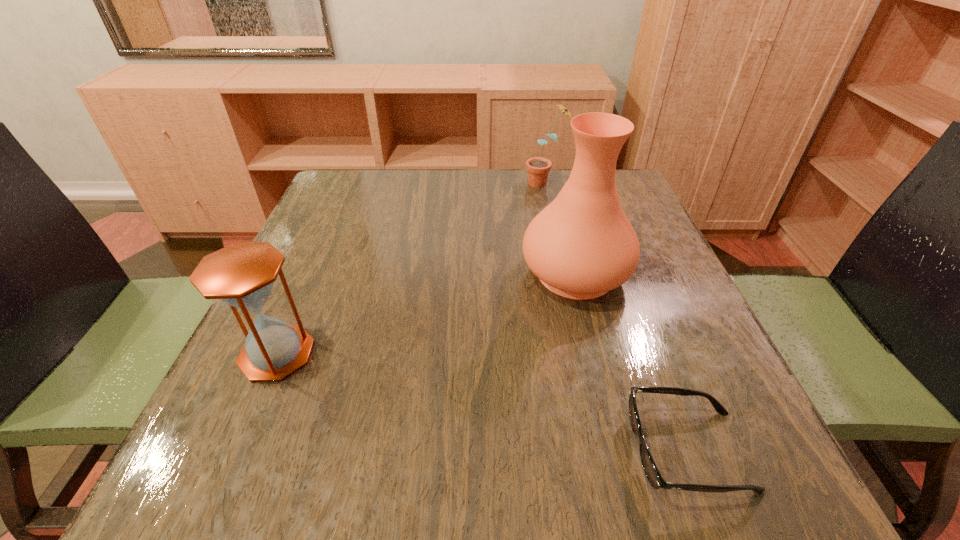
Find the location of `vacant space that's between the farthest object and the nearest object`. vacant space that's between the farthest object and the nearest object is located at coordinates (616, 317).

The height and width of the screenshot is (540, 960). I want to click on free space between the spectacles and the hourglass, so click(x=482, y=402).

At what (x,y) coordinates should I click in order to perform the action: click on free spot between the leftmost object and the farthest object. Please return your answer as a coordinate pair (x, y). Image resolution: width=960 pixels, height=540 pixels. Looking at the image, I should click on (411, 268).

The image size is (960, 540). I want to click on vacant space that is in between the farthest object and the third farthest object, so click(x=411, y=268).

Identify the location of free spot between the hourglass and the tallest object. (426, 314).

This screenshot has height=540, width=960. What are the coordinates of `empty space that is in between the leftmost object and the farthest object` in the screenshot? It's located at (411, 268).

You are a GUI agent. You are given a task and a screenshot of the screen. Output one action in this format:
    pyautogui.click(x=<x>, y=<y>)
    Task: Click on the second closest object to the leftmost object
    Image resolution: width=960 pixels, height=540 pixels.
    Given the screenshot: What is the action you would take?
    pyautogui.click(x=652, y=473)

Identify which object is the nearest to the spectacles. Please provide its 2D coordinates. Your answer should be formatted as a tuple, i.e. [(x, y)], where the tuple contains the x and y coordinates of a point satisfying the conditions above.

[(582, 245)]

Identify the location of vacant region that satisfies the following two spatial constraints: 1. on the flower of the second farthest object; 2. on the right side of the sunflower. The image size is (960, 540). (564, 273).

Where is `vacant region that satisfies the following two spatial constraints: 1. on the flower of the farthest object; 2. on the front side of the leftmost object`? The height and width of the screenshot is (540, 960). vacant region that satisfies the following two spatial constraints: 1. on the flower of the farthest object; 2. on the front side of the leftmost object is located at coordinates (583, 354).